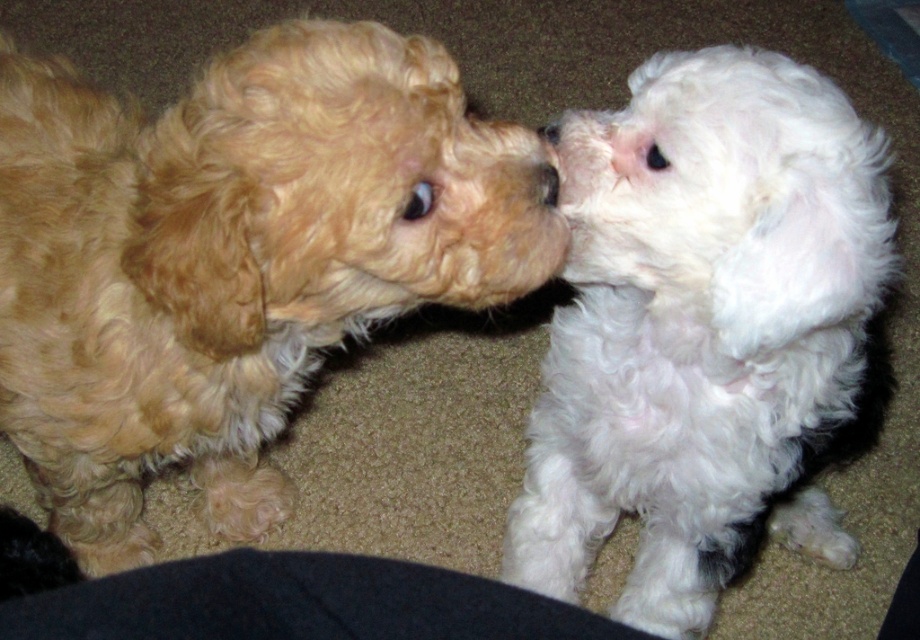
Question: Which point is farther to the camera?

Choices:
 (A) (792, 480)
 (B) (305, 38)

Answer: (A)

Question: Is golden curly fur dog at left smaller than white fluffy dog at right?

Choices:
 (A) no
 (B) yes

Answer: (A)

Question: Which of the following is the farthest from the observer?

Choices:
 (A) (608, 184)
 (B) (98, 154)

Answer: (B)

Question: Is golden curly fur dog at left wider than white fluffy dog at right?

Choices:
 (A) yes
 (B) no

Answer: (A)

Question: Does golden curly fur dog at left appear under white fluffy dog at right?

Choices:
 (A) no
 (B) yes

Answer: (A)